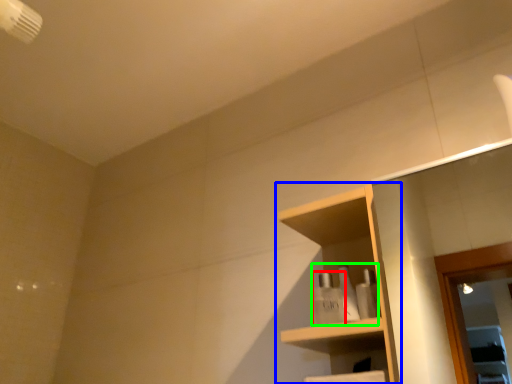
Question: Which object is positioned farthest from toiletry (highlighted by a red box)? Select from shelf (highlighted by a blue box) and toiletry (highlighted by a green box).

Choices:
 (A) shelf
 (B) toiletry

Answer: (A)